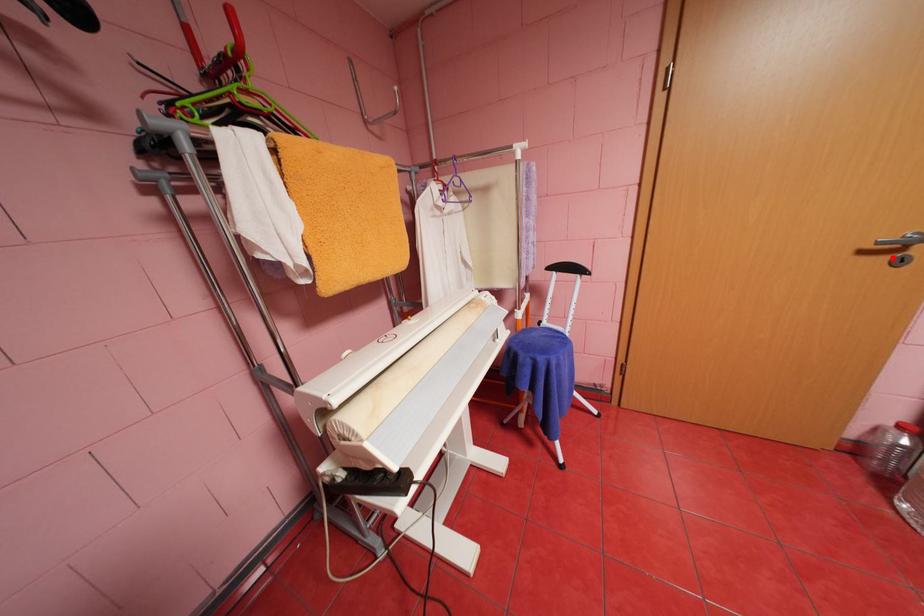
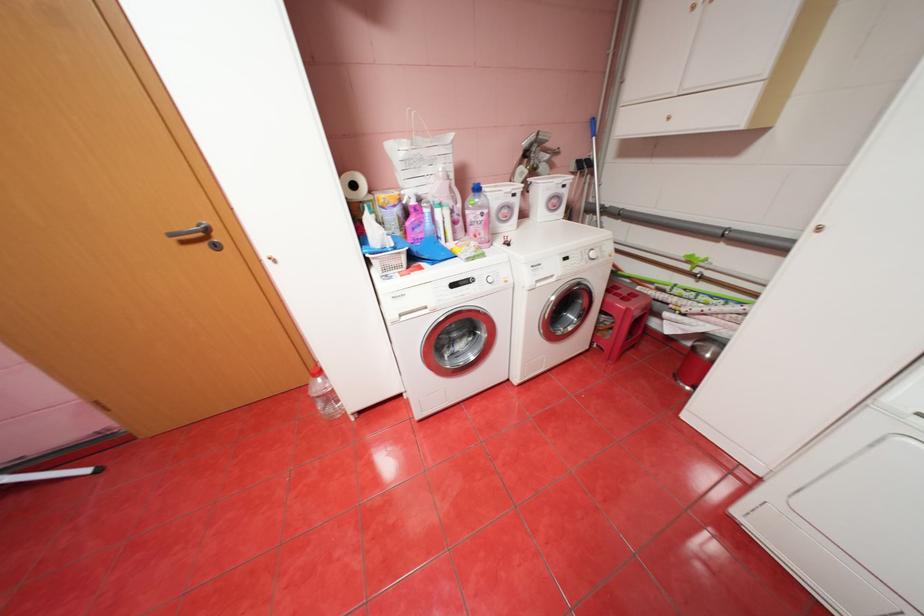
The point at the highlighted location is marked in the first image. Where is the corresponding point in the second image?

(213, 245)